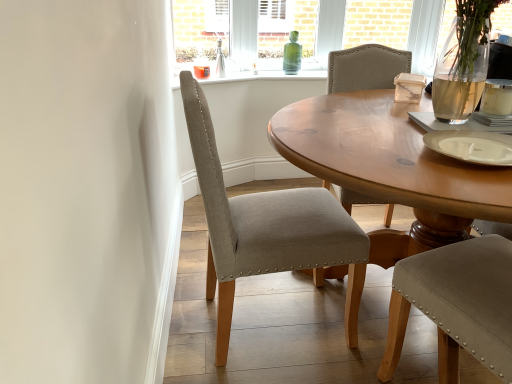
What do you see at coordinates (497, 97) in the screenshot?
I see `white ceramic coffee cup at upper right` at bounding box center [497, 97].

Where is `white matte plate at center-right`? Image resolution: width=512 pixels, height=384 pixels. white matte plate at center-right is located at coordinates click(472, 146).

What is the approximate height of green glass bottle at center?

green glass bottle at center is 10.59 inches tall.

Find the location of a particular element. The width and height of the screenshot is (512, 384). white ceramic coffee cup at upper right is located at coordinates (497, 97).

Locate an element on the screen. chair directly beneath the white matte plate at center-right (from a real-world perspective) is located at coordinates (267, 228).

From the image's perspective, which is above, light gray fabric chair at center or white matte plate at center-right?

white matte plate at center-right appears higher in the image.

Which object is wider, light gray fabric chair at center or white matte plate at center-right?

light gray fabric chair at center is wider.

Considering the relative positions of white ceramic coffee cup at upper right and green glass bottle at center in the image provided, is white ceramic coffee cup at upper right to the left of green glass bottle at center from the viewer's perspective?

No, white ceramic coffee cup at upper right is not to the left of green glass bottle at center.

Between point (493, 113) and point (293, 56), which one is positioned behind?

The point (293, 56) is behind.

The image size is (512, 384). In order to click on coffee cup in front of the green glass bottle at center in this screenshot , I will do `click(497, 97)`.

In the scene shown: Is white ceramic coffee cup at upper right shorter than green glass bottle at center?

Indeed, white ceramic coffee cup at upper right has a lesser height compared to green glass bottle at center.

Where is `chair in front of the white ceramic coffee cup at upper right`? Image resolution: width=512 pixels, height=384 pixels. chair in front of the white ceramic coffee cup at upper right is located at coordinates (267, 228).

Is point (485, 99) closer to viewer compared to point (280, 220)?

That is True.

Is the depth of white ceramic coffee cup at upper right greater than that of light gray fabric chair at center?

Yes, white ceramic coffee cup at upper right is further from the viewer.

Is white ceramic coffee cup at upper right positioned far away from light gray fabric chair at center?

white ceramic coffee cup at upper right is near light gray fabric chair at center, not far away.

Considering the relative sizes of white matte plate at center-right and light gray fabric chair at center in the image provided, is white matte plate at center-right bigger than light gray fabric chair at center?

Incorrect, white matte plate at center-right is not larger than light gray fabric chair at center.

The height and width of the screenshot is (384, 512). I want to click on chair that appears below the white matte plate at center-right (from a real-world perspective), so click(x=267, y=228).

Is point (461, 155) more distant than point (207, 276)?

No, (461, 155) is in front of (207, 276).

How many degrees apart are the facing directions of light gray fabric chair at center and white ceramic coffee cup at upper right?

There is a 5.91-degree angle between the facing directions of light gray fabric chair at center and white ceramic coffee cup at upper right.

Are light gray fabric chair at center and white ceramic coffee cup at upper right located far from each other?

No.

From a real-world perspective, is light gray fabric chair at center under white ceramic coffee cup at upper right?

Yes.

Can you confirm if light gray fabric chair at center is smaller than white ceramic coffee cup at upper right?

Incorrect, light gray fabric chair at center is not smaller in size than white ceramic coffee cup at upper right.

Is green glass bottle at center facing towards light gray fabric chair at center?

Yes, green glass bottle at center is aimed at light gray fabric chair at center.

Is point (295, 47) positioned before point (240, 204)?

No.

Are green glass bottle at center and light gray fabric chair at center beside each other?

No, green glass bottle at center is not next to light gray fabric chair at center.

Are green glass bottle at center and white ceramic coffee cup at upper right located far from each other?

Yes, green glass bottle at center and white ceramic coffee cup at upper right are quite far apart.

Is green glass bottle at center taller or shorter than white ceramic coffee cup at upper right?

In the image, green glass bottle at center appears to be taller than white ceramic coffee cup at upper right.

Which of these two, green glass bottle at center or white ceramic coffee cup at upper right, is bigger?

With larger size is green glass bottle at center.

Is green glass bottle at center outside of white ceramic coffee cup at upper right?

Yes, green glass bottle at center is outside of white ceramic coffee cup at upper right.

Image resolution: width=512 pixels, height=384 pixels. I want to click on chair to the left of white matte plate at center-right, so [267, 228].

Find the location of `coffee cup on the right of green glass bottle at center`. coffee cup on the right of green glass bottle at center is located at coordinates point(497,97).

Based on their spatial positions, is white matte plate at center-right or green glass bottle at center closer to light gray fabric chair at center?

Based on the image, white matte plate at center-right appears to be nearer to light gray fabric chair at center.

From the image, which object appears to be nearer to green glass bottle at center, white ceramic coffee cup at upper right or light gray fabric chair at center?

white ceramic coffee cup at upper right.

Estimate the real-world distances between objects in this image. Which object is closer to white matte plate at center-right, white ceramic coffee cup at upper right or light gray fabric chair at center?

white ceramic coffee cup at upper right is closer to white matte plate at center-right.

Which object lies nearer to the anchor point green glass bottle at center, white ceramic coffee cup at upper right or white matte plate at center-right?

The object closer to green glass bottle at center is white ceramic coffee cup at upper right.

Looking at the image, which one is located further to white matte plate at center-right, white ceramic coffee cup at upper right or green glass bottle at center?

The object further to white matte plate at center-right is green glass bottle at center.

Based on their spatial positions, is white matte plate at center-right or light gray fabric chair at center further from white ceramic coffee cup at upper right?

The object further to white ceramic coffee cup at upper right is light gray fabric chair at center.

From the picture: Looking at the image, which one is located further to white matte plate at center-right, light gray fabric chair at center or green glass bottle at center?

The object further to white matte plate at center-right is green glass bottle at center.

When comparing their distances from light gray fabric chair at center, does white matte plate at center-right or white ceramic coffee cup at upper right seem further?

white ceramic coffee cup at upper right is further to light gray fabric chair at center.

This screenshot has height=384, width=512. Identify the location of coffee cup located between white matte plate at center-right and green glass bottle at center in the depth direction. (497, 97).

Where is `plate located between light gray fabric chair at center and white ceramic coffee cup at upper right in the left-right direction`? The image size is (512, 384). plate located between light gray fabric chair at center and white ceramic coffee cup at upper right in the left-right direction is located at coordinates tap(472, 146).

Identify the location of chair located between white matte plate at center-right and green glass bottle at center in the depth direction. The height and width of the screenshot is (384, 512). (267, 228).

This screenshot has width=512, height=384. Find the location of `coffee cup between light gray fabric chair at center and green glass bottle at center along the z-axis`. coffee cup between light gray fabric chair at center and green glass bottle at center along the z-axis is located at coordinates (497, 97).